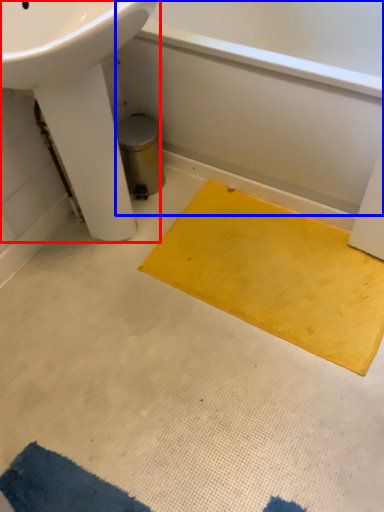
Question: Among these objects, which one is nearest to the camera, sink (highlighted by a red box) or bath (highlighted by a blue box)?

Choices:
 (A) sink
 (B) bath

Answer: (A)